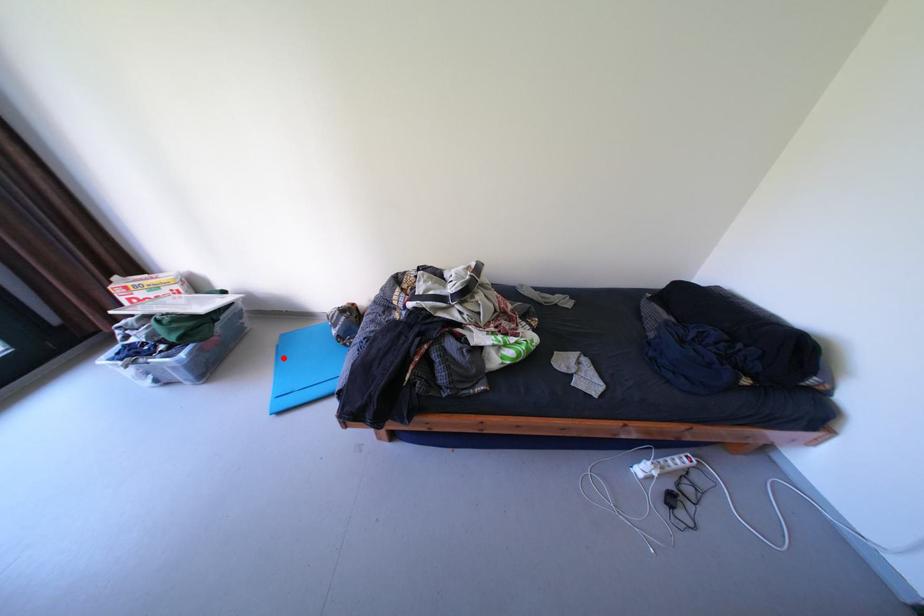
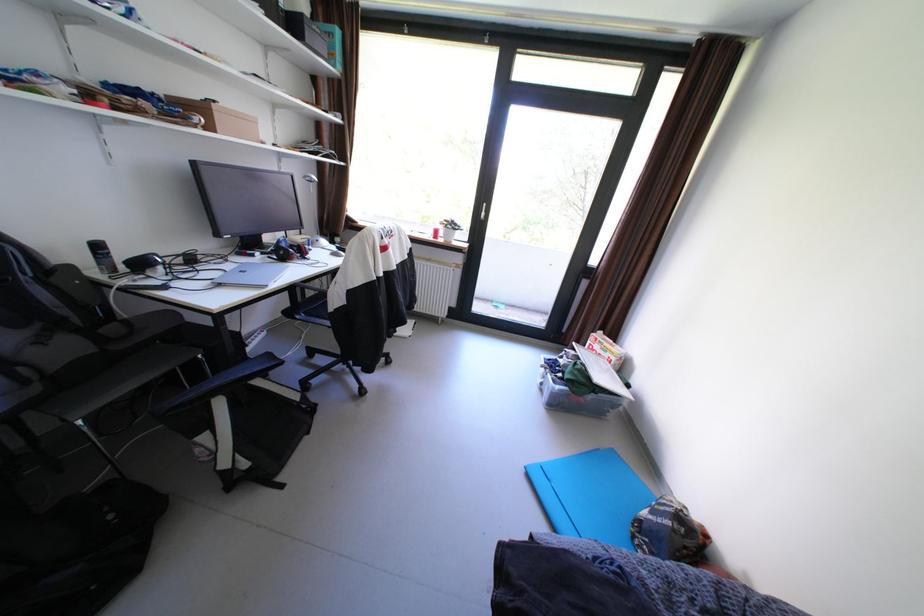
Question: I am providing you with two images of the same scene from different viewpoints. Image1 has a red point marked. In image2, the corresponding 3D location appears at what relative position? Reply with the corresponding letter.

Choices:
 (A) Closer
 (B) Farther

Answer: (A)